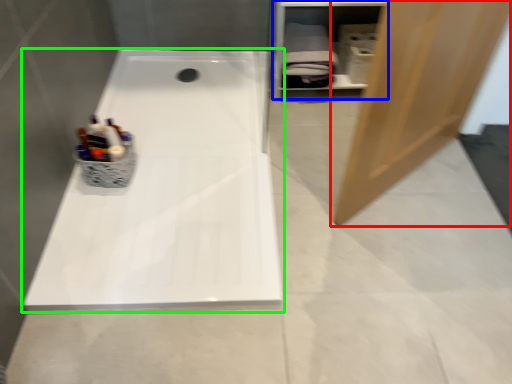
Question: Which object is the closest to the door (highlighted by a red box)? Choose among these: shelf (highlighted by a blue box) or bathtub (highlighted by a green box).

Choices:
 (A) shelf
 (B) bathtub

Answer: (B)